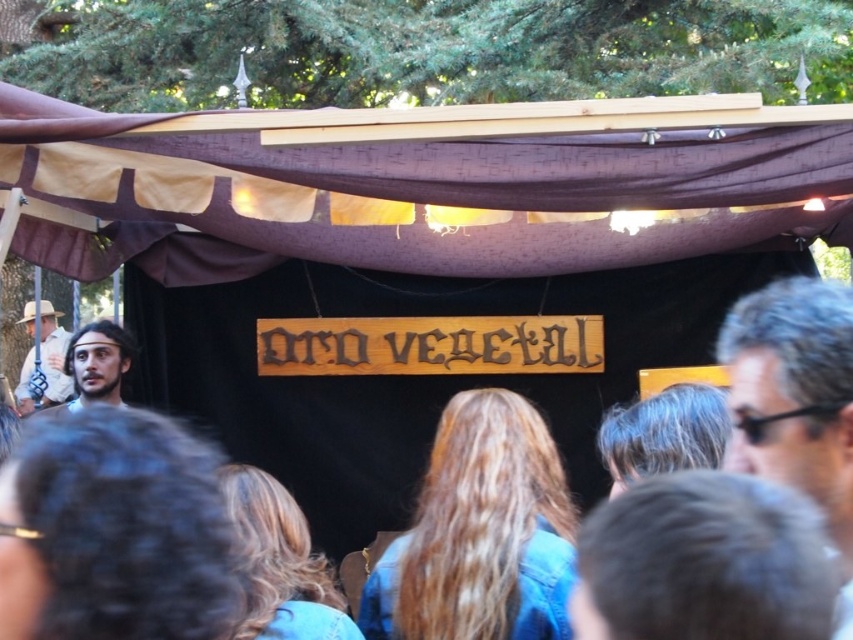
You are a photographer at the event. You want to capture a photo of the crowd, focusing on the gray hair at right and the matte brown hat at left. Based on their positions, which one is higher in the frame?

The gray hair at right is above the matte brown hat at left in the frame.

You are a photographer taking a picture of the stage setup. You notice the brown fabric canopy at upper center and the smooth brown hair at center. Which object should you focus on first to ensure both are in sharp focus?

The brown fabric canopy at upper center is closer to the viewer than the smooth brown hair at center, so you should focus on the brown fabric canopy at upper center first to ensure both are in sharp focus.